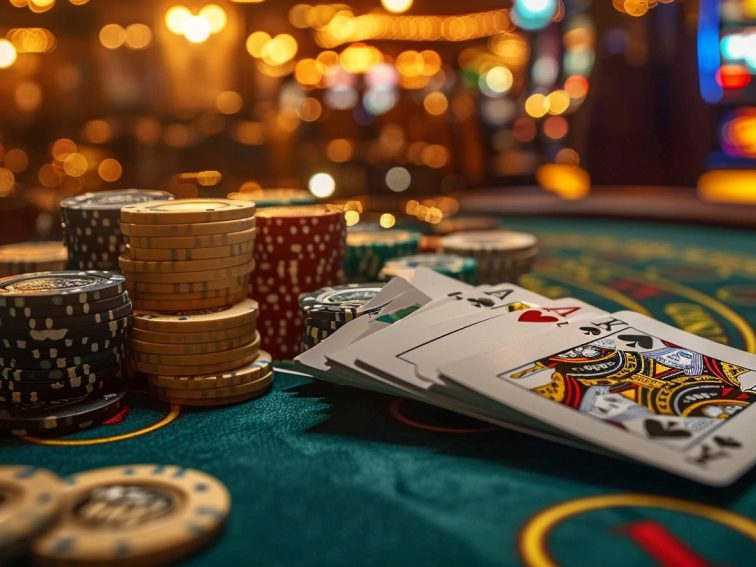
Where is `playing cards`? playing cards is located at coordinates (550, 353), (507, 342), (481, 295), (451, 295), (314, 354), (376, 321).